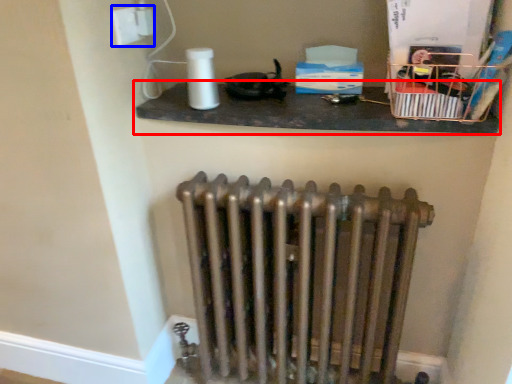
Question: Among these objects, which one is farthest to the camera, shelf (highlighted by a red box) or electric outlet (highlighted by a blue box)?

Choices:
 (A) shelf
 (B) electric outlet

Answer: (B)